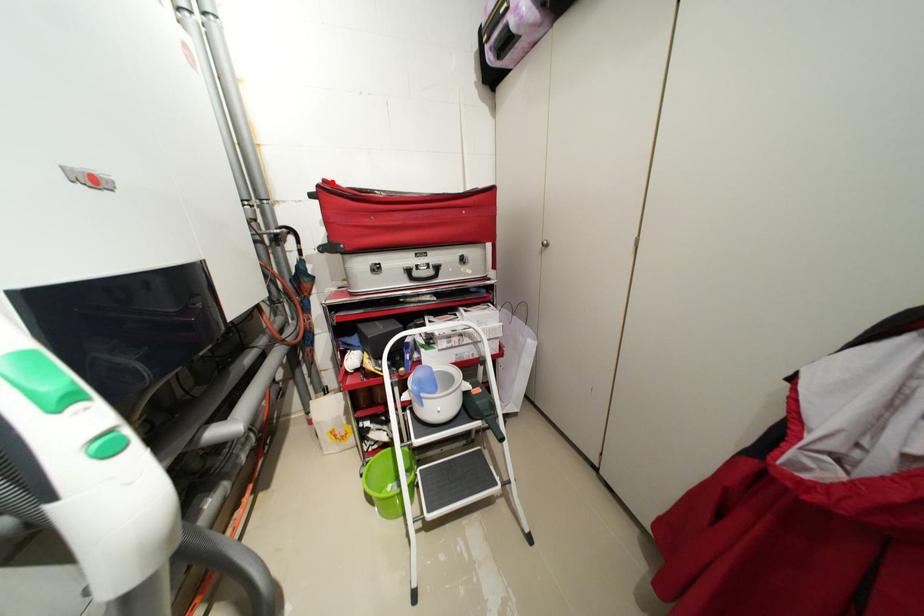
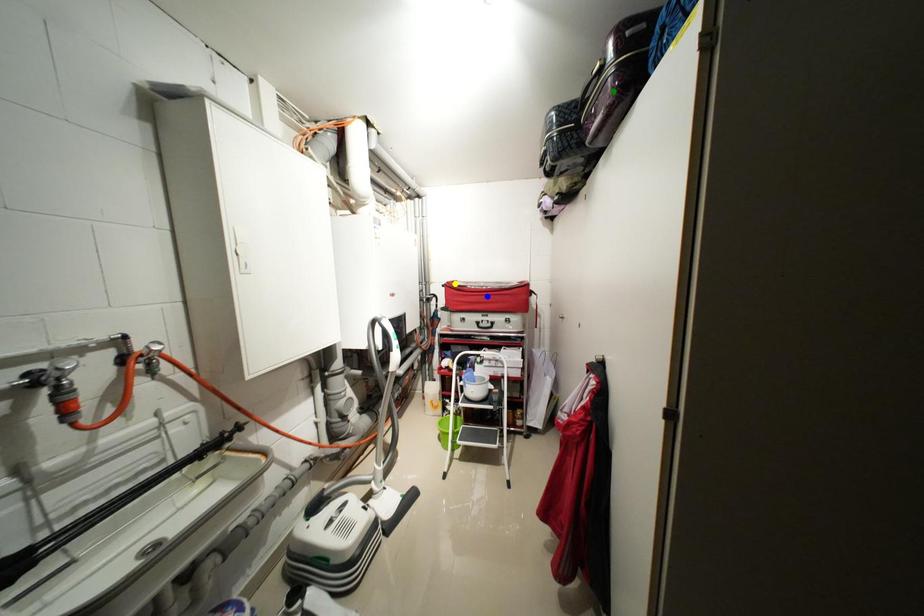
Question: I am providing you with two images of the same scene from different viewpoints. A red point is marked on the first image. You are given multiple points on the second image. Which mark in image 2 goes with the point in image 1?

Choices:
 (A) green point
 (B) yellow point
 (C) blue point

Answer: (B)